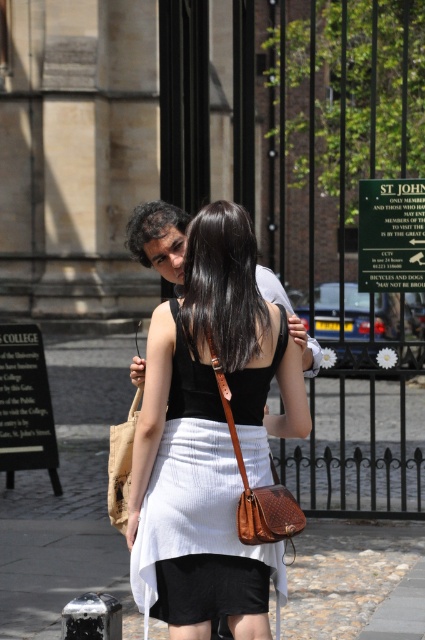
Question: Is white fabric skirt at center thinner than brown leather shoulder bag at center?

Choices:
 (A) no
 (B) yes

Answer: (A)

Question: Which object appears farthest from the camera in this image?

Choices:
 (A) black matte dress at center
 (B) black cotton shorts at lower center
 (C) matte brown purse at center

Answer: (A)

Question: Where is black cotton shorts at lower center located in relation to brown leather shoulder bag at center in the image?

Choices:
 (A) right
 (B) left

Answer: (B)

Question: Among these objects, which one is nearest to the camera?

Choices:
 (A) white fabric skirt at center
 (B) brown leather shoulder bag at center

Answer: (B)

Question: Does black cotton shorts at lower center appear over brown leather shoulder bag at center?

Choices:
 (A) yes
 (B) no

Answer: (B)

Question: Which point appears farthest from the camera in this image?

Choices:
 (A) (255, 556)
 (B) (316, 372)
 (C) (257, 524)

Answer: (B)